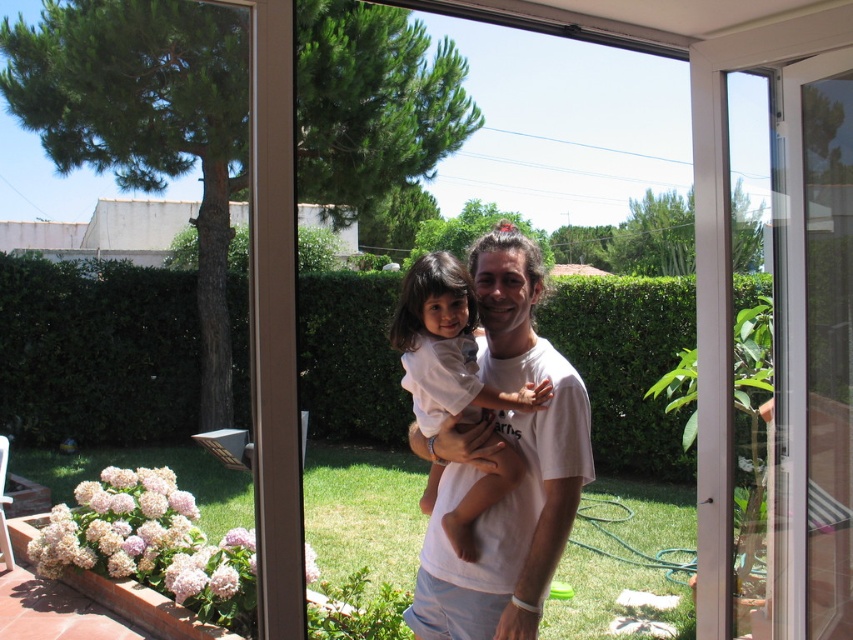
Question: Among these objects, which one is farthest from the camera?

Choices:
 (A) white cotton shirt at center
 (B) transparent glass door at center
 (C) white plastic screen door at right

Answer: (C)

Question: Is white plastic screen door at right smaller than white cotton shirt at center?

Choices:
 (A) yes
 (B) no

Answer: (B)

Question: Which object is the farthest from the transparent glass door at center?

Choices:
 (A) white cotton shirt at center
 (B) white plastic screen door at right

Answer: (A)

Question: Does transparent glass door at center have a larger size compared to white cotton shirt at center?

Choices:
 (A) no
 (B) yes

Answer: (B)

Question: Is the position of white plastic screen door at right less distant than that of white cotton shirt at center?

Choices:
 (A) yes
 (B) no

Answer: (B)

Question: Which object is the farthest from the transparent glass door at center?

Choices:
 (A) white plastic screen door at right
 (B) white cotton shirt at center

Answer: (B)